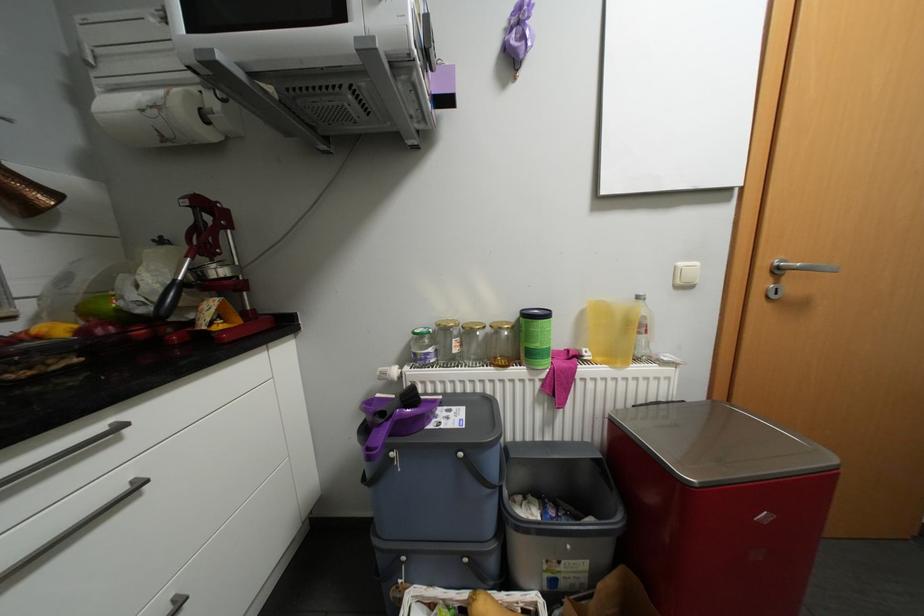
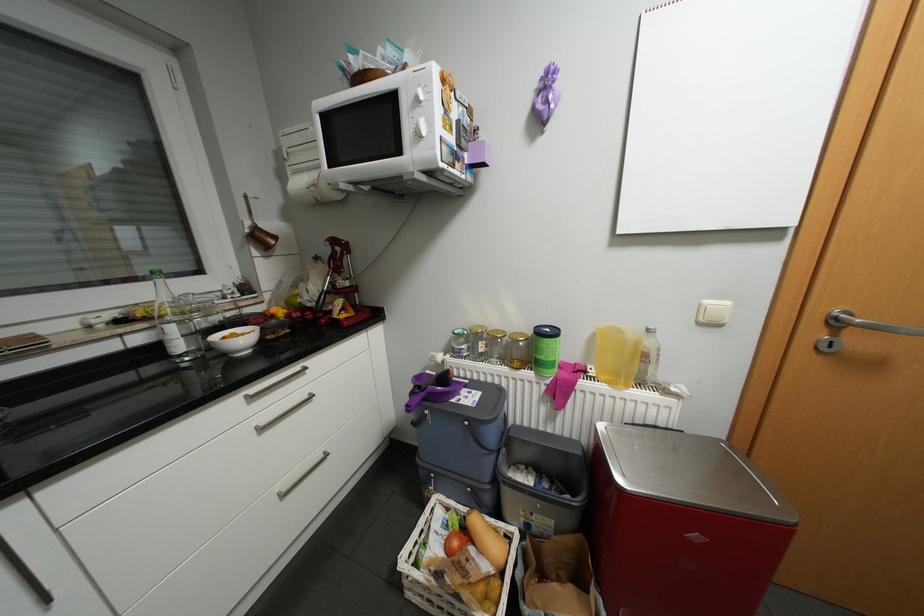
In the second image, find the point that corresponds to (462,339) in the first image.

(488, 342)